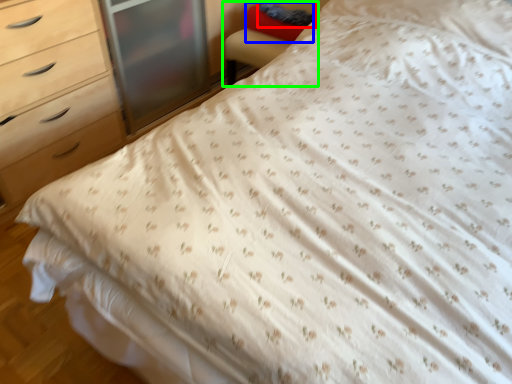
Question: Which object is positioned closest to pillow (highlighted by a red box)? Select from pillow (highlighted by a blue box) and armchair (highlighted by a green box).

Choices:
 (A) pillow
 (B) armchair

Answer: (A)